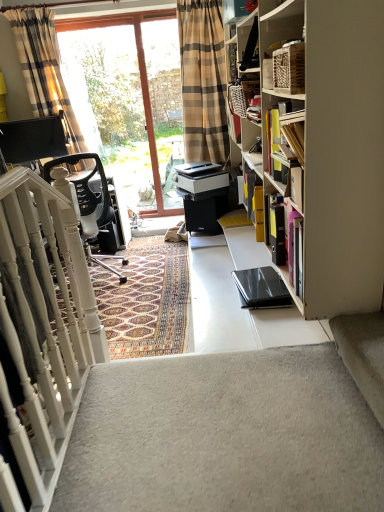
Locate an element on the screen. This screenshot has height=512, width=384. yellow cardboard boxes at upper right is located at coordinates (285, 147).

Image resolution: width=384 pixels, height=512 pixels. What do you see at coordinates (200, 177) in the screenshot?
I see `white plastic printer at center` at bounding box center [200, 177].

Where is `transparent glass window at upper center`? The image size is (384, 512). transparent glass window at upper center is located at coordinates (129, 101).

What do you see at coordinates (224, 436) in the screenshot?
I see `white carpet at lower left` at bounding box center [224, 436].

This screenshot has width=384, height=512. Describe the element at coordinates (88, 202) in the screenshot. I see `black mesh office chair at left` at that location.

Identify the location of yellow cardboard boxes at upper right. (285, 147).

Is black mesh office chair at left not inside white plastic printer at center?

black mesh office chair at left is positioned outside white plastic printer at center.

Is point (86, 227) more distant than point (193, 170)?

That is False.

From the image's perspective, between black mesh office chair at left and white plastic printer at center, which one is located above?

From the image's view, white plastic printer at center is above.

Can black glossy phone at right be found inside white carpet at lower left?

Yes, white carpet at lower left contains black glossy phone at right.

Which is more to the left, white carpet at lower left or black glossy phone at right?

white carpet at lower left.

How much distance is there between white carpet at lower left and black glossy phone at right?

white carpet at lower left is 31.21 inches from black glossy phone at right.

Is white carpet at lower left oriented away from black glossy phone at right?

Correct, white carpet at lower left is looking away from black glossy phone at right.

At what (x,y) coordinates should I click in order to perform the action: click on equipment in front of the white plastic printer at center. Please return your answer as a coordinate pair (x, y). Looking at the image, I should click on (261, 288).

Considering the relative sizes of white plastic printer at center and black glossy phone at right in the image provided, is white plastic printer at center smaller than black glossy phone at right?

No, white plastic printer at center is not smaller than black glossy phone at right.

From the image's perspective, is white plastic printer at center located above black glossy phone at right?

Yes, from the image's perspective, white plastic printer at center is above black glossy phone at right.

Could you tell me if plaid fabric curtain at upper left is turned towards transparent glass screen door at upper left?

No, plaid fabric curtain at upper left does not turn towards transparent glass screen door at upper left.

From the picture: Can you see plaid fabric curtain at upper left touching transparent glass screen door at upper left?

No, plaid fabric curtain at upper left is not making contact with transparent glass screen door at upper left.

Does plaid fabric curtain at upper left appear on the right side of transparent glass screen door at upper left?

In fact, plaid fabric curtain at upper left is to the left of transparent glass screen door at upper left.

Can you confirm if white painted wood stairs at left is smaller than plaid fabric curtain at upper left?

No.

There is a white painted wood stairs at left. At what (x,y) coordinates should I click in order to perform the action: click on curtain above it (from a real-world perspective). Please return your answer as a coordinate pair (x, y). Looking at the image, I should click on (43, 67).

Measure the distance from white painted wood stairs at left to plaid fabric curtain at upper left.

2.80 meters.

Considering the relative positions of white painted wood stairs at left and plaid fabric curtain at upper left in the image provided, is white painted wood stairs at left to the right of plaid fabric curtain at upper left from the viewer's perspective?

Correct, you'll find white painted wood stairs at left to the right of plaid fabric curtain at upper left.

Would you consider white painted wood stairs at left to be distant from black glossy phone at right?

That's right, there is a large distance between white painted wood stairs at left and black glossy phone at right.

From the image's perspective, between white painted wood stairs at left and black glossy phone at right, which one is located above?

black glossy phone at right, from the image's perspective.

Based on their sizes in the image, would you say white painted wood stairs at left is bigger or smaller than black glossy phone at right?

Clearly, white painted wood stairs at left is larger in size than black glossy phone at right.

How different are the orientations of white plastic printer at center and black mesh office chair at left in degrees?

There is a 83.7-degree angle between the facing directions of white plastic printer at center and black mesh office chair at left.

Are white plastic printer at center and black mesh office chair at left beside each other?

No, white plastic printer at center is not touching black mesh office chair at left.

Would you say white plastic printer at center is inside or outside black mesh office chair at left?

white plastic printer at center is not enclosed by black mesh office chair at left.

From the image's perspective, is white plastic printer at center positioned above or below black mesh office chair at left?

From the image's perspective, white plastic printer at center appears above black mesh office chair at left.

Where is `printer above the black mesh office chair at left (from a real-world perspective)`? The width and height of the screenshot is (384, 512). printer above the black mesh office chair at left (from a real-world perspective) is located at coordinates (200, 177).

The width and height of the screenshot is (384, 512). Identify the location of stairwell below the black glossy phone at right (from the image's perspective). (224, 436).

Considering their positions, is white carpet at lower left positioned closer to transparent glass screen door at upper left than plaid fabric curtain at upper left?

plaid fabric curtain at upper left is positioned closer to the anchor transparent glass screen door at upper left.

When comparing their distances from transparent glass window at upper center, does black glossy phone at right or yellow cardboard boxes at upper right seem further?

The object further to transparent glass window at upper center is black glossy phone at right.

Which object lies further to the anchor point black glossy phone at right, white plastic printer at center or patterned carpet at center?

white plastic printer at center is further to black glossy phone at right.

Estimate the real-world distances between objects in this image. Which object is closer to white painted wood stairs at left, white carpet at lower left or transparent glass screen door at upper left?

Based on the image, white carpet at lower left appears to be nearer to white painted wood stairs at left.

Based on their spatial positions, is transparent glass window at upper center or black glossy phone at right closer to white plastic printer at center?

The object closer to white plastic printer at center is black glossy phone at right.

When comparing their distances from black glossy phone at right, does black mesh office chair at left or transparent glass screen door at upper left seem closer?

black mesh office chair at left.

Estimate the real-world distances between objects in this image. Which object is further from white carpet at lower left, transparent glass window at upper center or white painted wood stairs at left?

The object further to white carpet at lower left is transparent glass window at upper center.

Based on the photo, considering their positions, is white carpet at lower left positioned further to white painted wood stairs at left than black glossy phone at right?

black glossy phone at right.

Where is `mat between black glossy phone at right and white plastic printer at center along the z-axis`? This screenshot has height=512, width=384. mat between black glossy phone at right and white plastic printer at center along the z-axis is located at coordinates (145, 300).

This screenshot has height=512, width=384. Find the location of `printer between yellow cardboard boxes at upper right and transparent glass screen door at upper left along the z-axis`. printer between yellow cardboard boxes at upper right and transparent glass screen door at upper left along the z-axis is located at coordinates (200, 177).

In order to click on mat located between white painted wood stairs at left and white plastic printer at center in the depth direction in this screenshot , I will do `click(145, 300)`.

I want to click on printer between white painted wood stairs at left and transparent glass screen door at upper left along the z-axis, so click(200, 177).